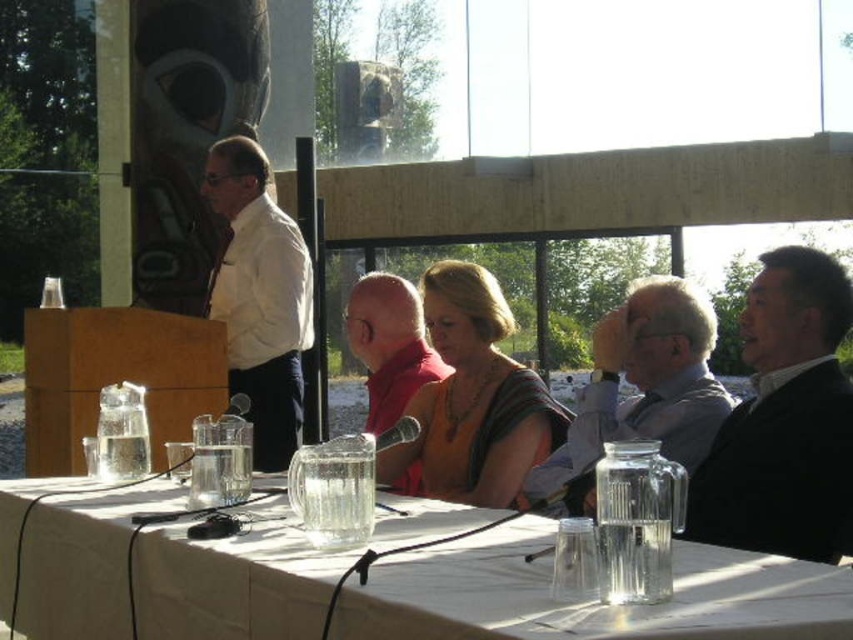
Which is behind, point (843, 332) or point (660, 275)?

Point (660, 275)

Which of these two, black suit at right or gray fabric shirt at right, stands taller?

With more height is black suit at right.

Identify the location of black suit at right. The height and width of the screenshot is (640, 853). (785, 420).

Consider the image. Does gray fabric shirt at right have a lesser width compared to red fabric scarf at center?

No, gray fabric shirt at right is not thinner than red fabric scarf at center.

At what (x,y) coordinates should I click in order to perform the action: click on gray fabric shirt at right. Please return your answer as a coordinate pair (x, y). Looking at the image, I should click on (643, 387).

I want to click on gray fabric shirt at right, so click(643, 387).

Does black suit at right appear over matte white shirt at left?

No, black suit at right is not above matte white shirt at left.

Does black suit at right appear on the right side of matte white shirt at left?

Yes, black suit at right is to the right of matte white shirt at left.

Between point (845, 307) and point (292, 301), which one is positioned in front?

Point (845, 307) is in front.

The height and width of the screenshot is (640, 853). I want to click on black suit at right, so click(x=785, y=420).